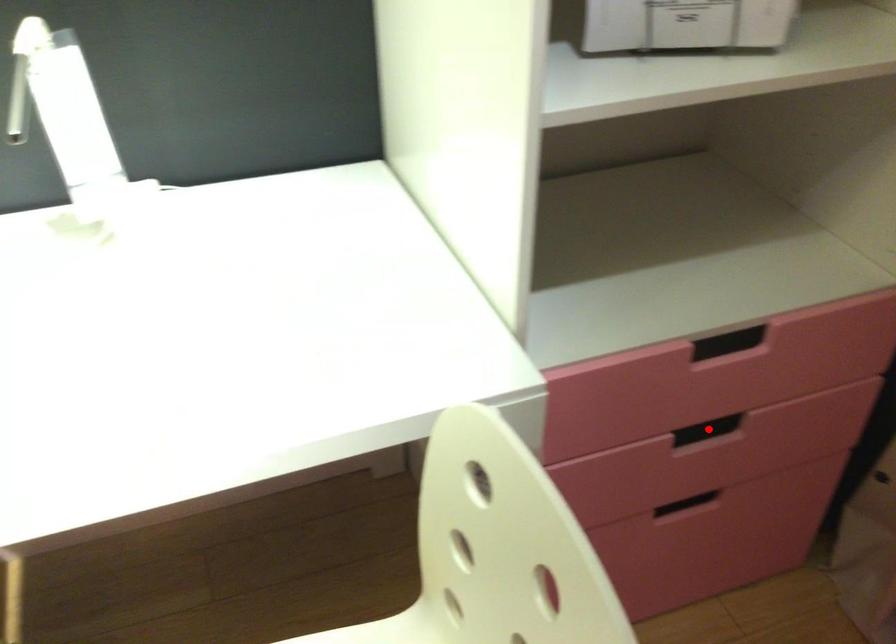
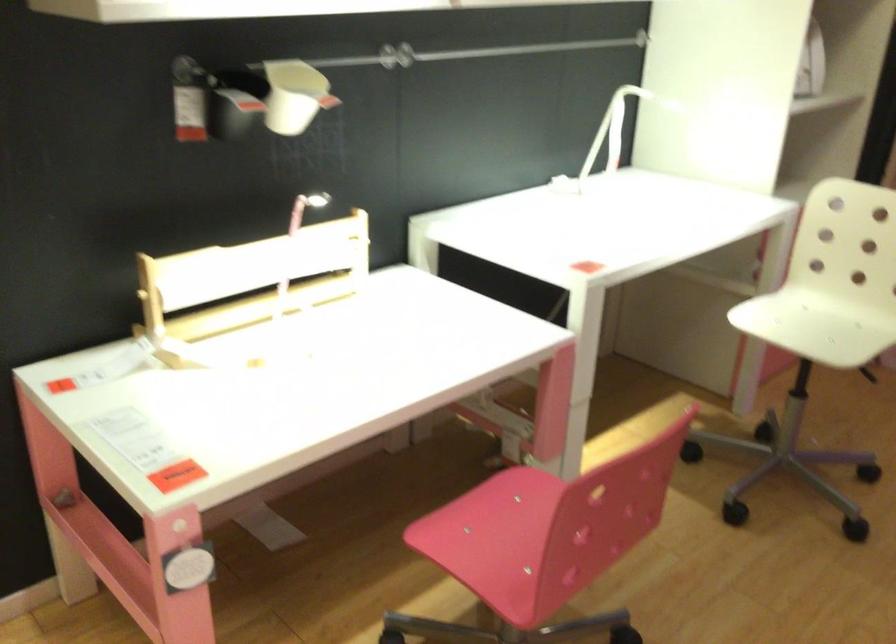
Question: I am providing you with two images of the same scene from different viewpoints. A red point is marked on the first image. At the location where the point appears in image 1, is it still visible in image 2?

Choices:
 (A) Yes
 (B) No

Answer: (B)